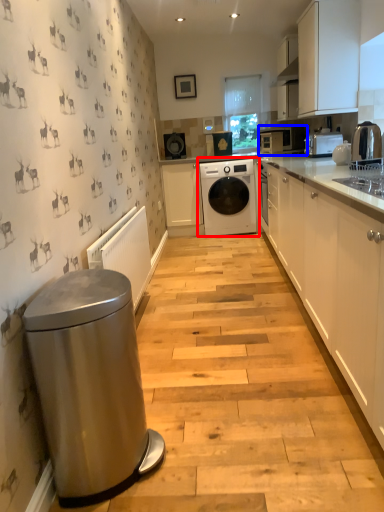
Question: Which object is further to the camera taking this photo, washing machine (highlighted by a red box) or home appliance (highlighted by a blue box)?

Choices:
 (A) washing machine
 (B) home appliance

Answer: (B)